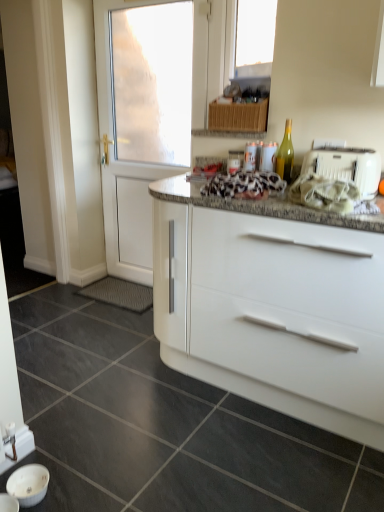
Question: Should I look upward or downward to see white plastic toaster at right?

Choices:
 (A) up
 (B) down

Answer: (A)

Question: From the image's perspective, does granite at center appear lower than white glossy door at left?

Choices:
 (A) yes
 (B) no

Answer: (A)

Question: Is granite at center wider than white glossy door at left?

Choices:
 (A) no
 (B) yes

Answer: (B)

Question: Does granite at center turn towards white glossy door at left?

Choices:
 (A) no
 (B) yes

Answer: (A)

Question: Is granite at center to the right of white glossy door at left from the viewer's perspective?

Choices:
 (A) no
 (B) yes

Answer: (A)

Question: Considering the relative sizes of granite at center and white glossy door at left in the image provided, is granite at center smaller than white glossy door at left?

Choices:
 (A) yes
 (B) no

Answer: (B)

Question: Is granite at center completely or partially outside of white glossy door at left?

Choices:
 (A) no
 (B) yes

Answer: (B)

Question: Is green glass bottle at upper right looking in the opposite direction of granite at center?

Choices:
 (A) yes
 (B) no

Answer: (B)

Question: Is green glass bottle at upper right further to the viewer compared to granite at center?

Choices:
 (A) no
 (B) yes

Answer: (B)

Question: Is green glass bottle at upper right bigger than granite at center?

Choices:
 (A) yes
 (B) no

Answer: (B)

Question: From the image's perspective, is green glass bottle at upper right below granite at center?

Choices:
 (A) no
 (B) yes

Answer: (A)

Question: Is green glass bottle at upper right wider than granite at center?

Choices:
 (A) yes
 (B) no

Answer: (B)

Question: Is green glass bottle at upper right facing towards granite at center?

Choices:
 (A) no
 (B) yes

Answer: (A)

Question: Is white plastic toaster at right smaller than green glass bottle at upper right?

Choices:
 (A) yes
 (B) no

Answer: (B)